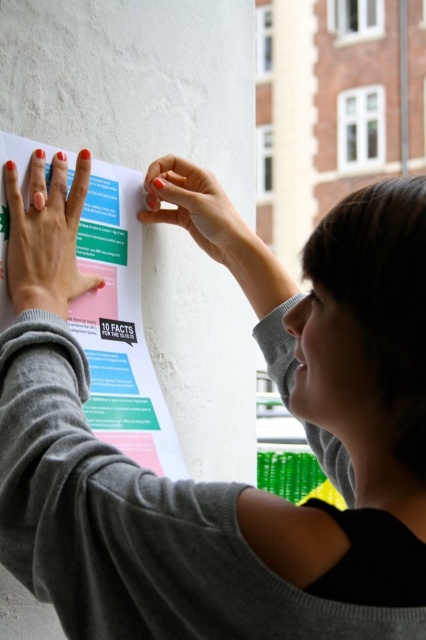
What is the spatial relationship between the matte pink nail polish at upper left and the black rectangle near the bottom left corner of the poster?

The matte pink nail polish at upper left is located at point (46, 236), while the black rectangle near the bottom left corner is at a lower position on the poster, so the matte pink nail polish at upper left is above the black rectangle near the bottom left corner.

Consider the image. What is the exact location of the white paper poster at upper left in the image?

The white paper poster at upper left is located at point (x=120, y=324).